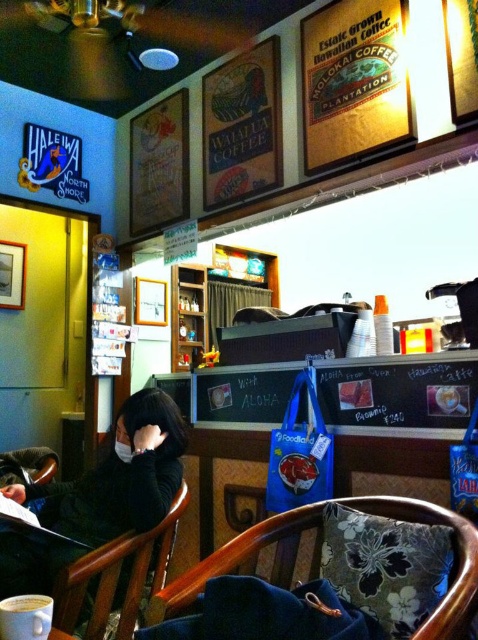
You are a barista preparing to place a new menu board on a surface in the cafe. The menu board is 1.2 meters tall. You have two options for placement locations. The first option is on the wooden chair at lower center. The second option is on the white matte cup at center. Based on the height of these objects, which location would be more appropriate for placing the menu board?

The wooden chair at lower center has a greater height compared to the white matte cup at center. Therefore, placing the menu board on the wooden chair at lower center would be more appropriate since it can support the height of the menu board better than the cup.

You are a barista in the coffee shop. You need to place a new coffee cup on the table so it doesn not block the customer sitting in the wooden chair at lower center. Where should you place the white matte cup at center?

The wooden chair at lower center is below the white matte cup at center, so placing the cup above the chair would ensure it doesn not block the customer.